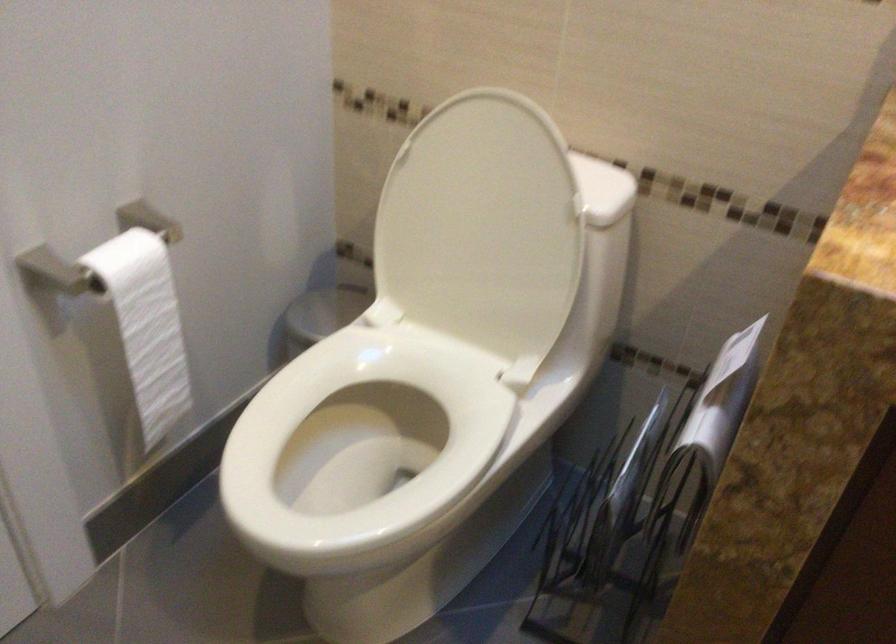
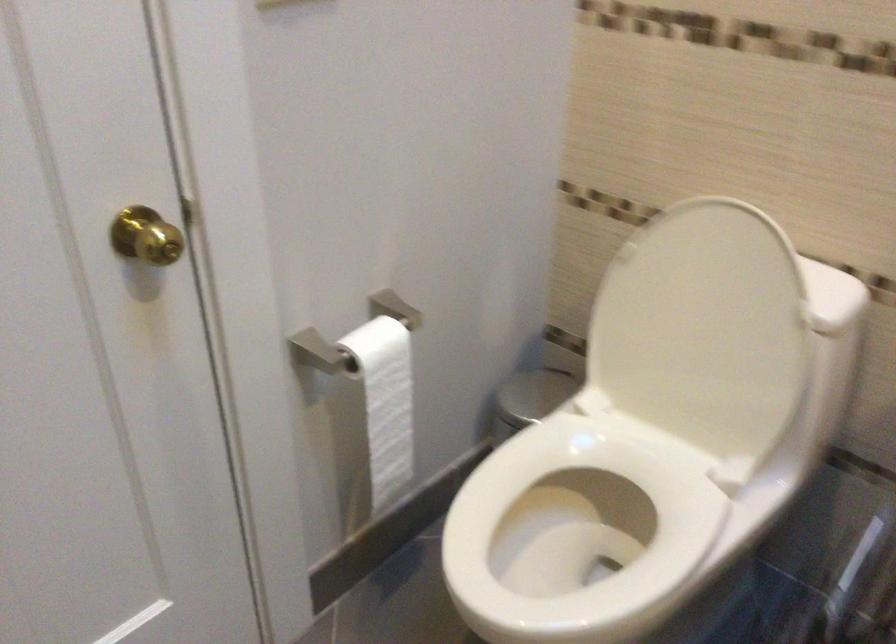
Question: The first image is from the beginning of the video and the second image is from the end. How did the camera likely rotate when shooting the video?

Choices:
 (A) Left
 (B) Right
 (C) Up
 (D) Down

Answer: (A)